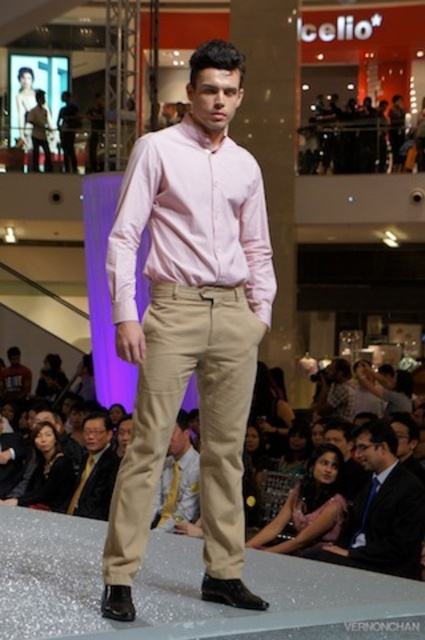
Which is more to the right, matte khaki pants at center or dark blue suit at lower right?

dark blue suit at lower right is more to the right.

Based on the photo, is matte khaki pants at center below dark blue suit at lower right?

No.

What are the coordinates of `matte khaki pants at center` in the screenshot? It's located at (189, 323).

Who is more distant from viewer, (325,516) or (42,444)?

Point (42,444)

Which of these two, khaki cotton pants at center or black leather jacket at lower left, stands shorter?

black leather jacket at lower left

Describe the element at coordinates (379, 509) in the screenshot. I see `khaki cotton pants at center` at that location.

Find the location of `khaki cotton pants at center`. khaki cotton pants at center is located at coordinates [x=379, y=509].

Can you confirm if light brown cotton pants at lower left is positioned below black leather jacket at lower left?

Yes, light brown cotton pants at lower left is below black leather jacket at lower left.

Does point (93, 515) come closer to viewer compared to point (34, 442)?

Yes.

Find the location of a particular element. The width and height of the screenshot is (425, 640). light brown cotton pants at lower left is located at coordinates (95, 468).

Where is `light brown cotton pants at lower left`? The width and height of the screenshot is (425, 640). light brown cotton pants at lower left is located at coordinates (95, 468).